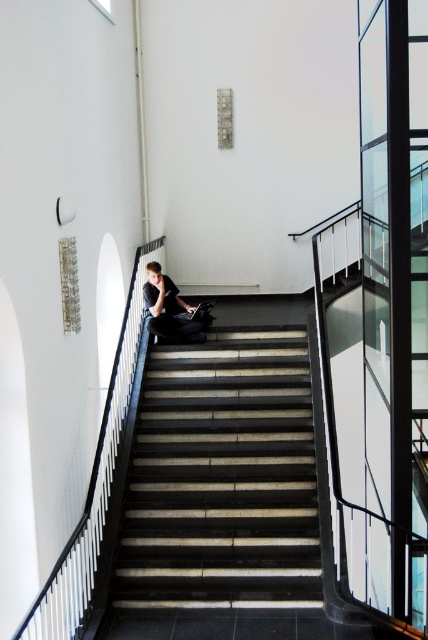
Does dark gray concrete stairs at center appear on the right side of dark gray fabric jacket at center?

Correct, you'll find dark gray concrete stairs at center to the right of dark gray fabric jacket at center.

Who is positioned more to the left, dark gray concrete stairs at center or dark gray fabric jacket at center?

dark gray fabric jacket at center is more to the left.

I want to click on dark gray concrete stairs at center, so click(222, 477).